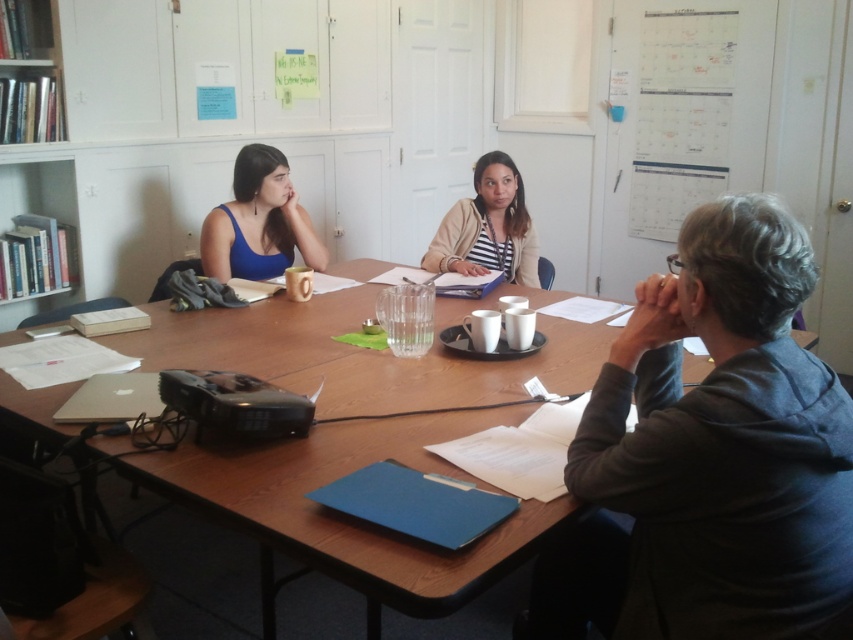
You are organizing a small workshop and need to place a large poster on the table. The poster is as wide as the gray cotton hoodie at lower right. Will it fit on the wooden table at center without overlapping the edges?

The gray cotton hoodie at lower right is narrower than the wooden table at center, so the poster will fit without overlapping the edges.

You are a guest arriving at the meeting and need to sit down. There is a wooden table at center and a matte blue tank top at left. Which object is wider so you can choose the best seat?

The wooden table at center is wider than the matte blue tank top at left, so you should choose the seat near the wooden table at center for more space.